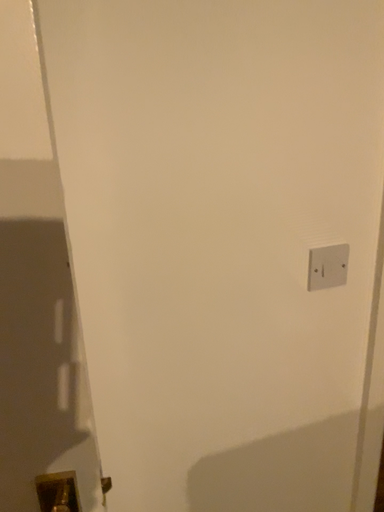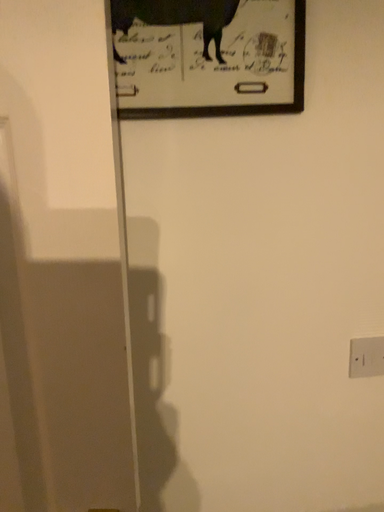
Question: How did the camera likely rotate when shooting the video?

Choices:
 (A) rotated left
 (B) rotated right

Answer: (A)